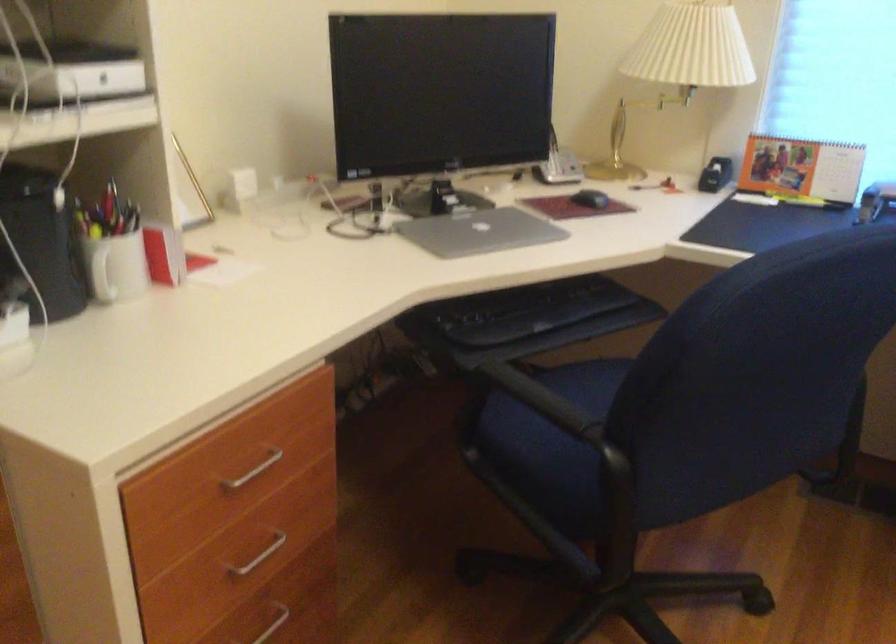
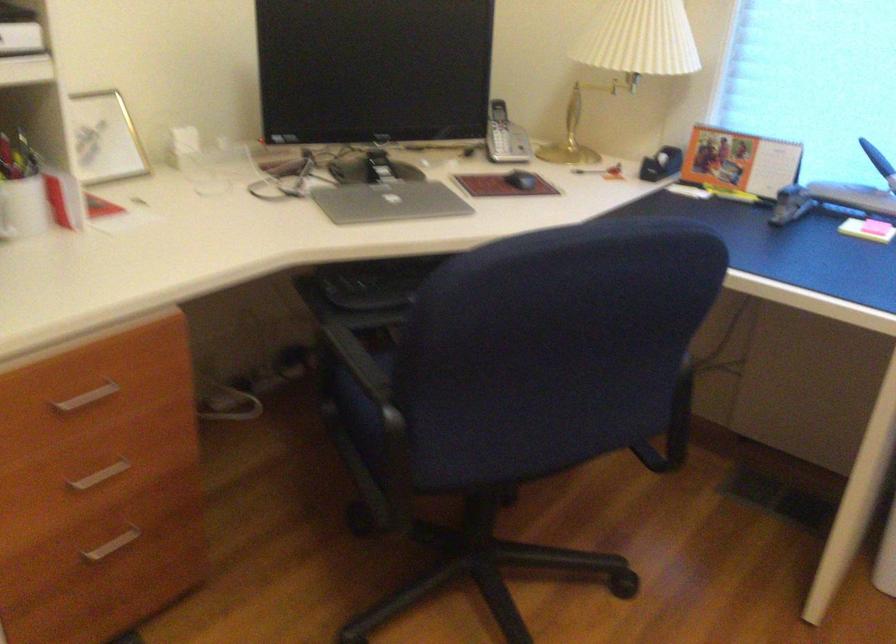
In the second image, find the point that corresponds to point 239,469 in the first image.

(87, 397)